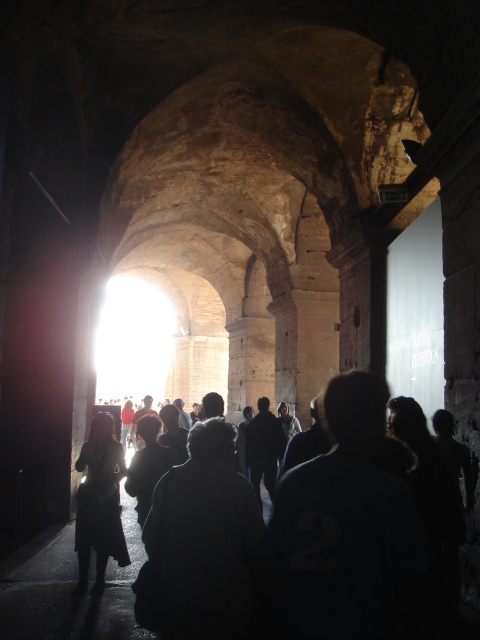
Does dark fabric jacket at center appear over dark hair at center?

Indeed, dark fabric jacket at center is positioned over dark hair at center.

From the picture: Is dark fabric jacket at center behind dark hair at center?

No, dark fabric jacket at center is closer to the viewer.

Find the location of a particular element. The width and height of the screenshot is (480, 640). dark fabric jacket at center is located at coordinates (355, 532).